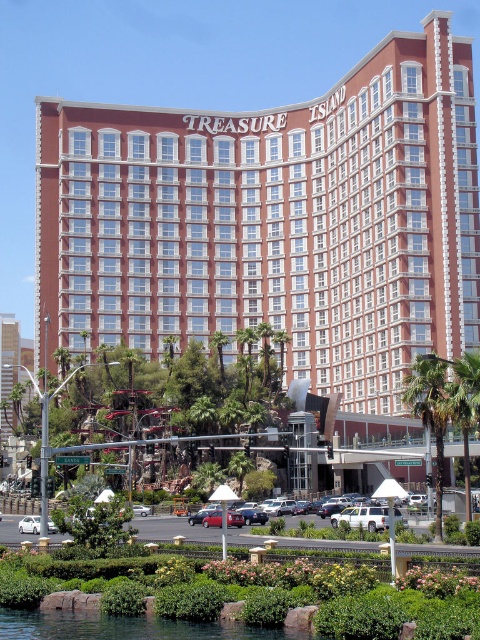
You are standing in front of the Treasure Island Hotel and Casino. You notice the red brick hotel at center and the green leafy palm tree at center. Which object is taller?

The red brick hotel at center is much taller than the green leafy palm tree at center.

You are standing on the Las Vegas Strip and see the red brick hotel at center and the green leafy palm tree at center. Which object is positioned more to the left?

The red brick hotel at center is positioned more to the left than the green leafy palm tree at center.